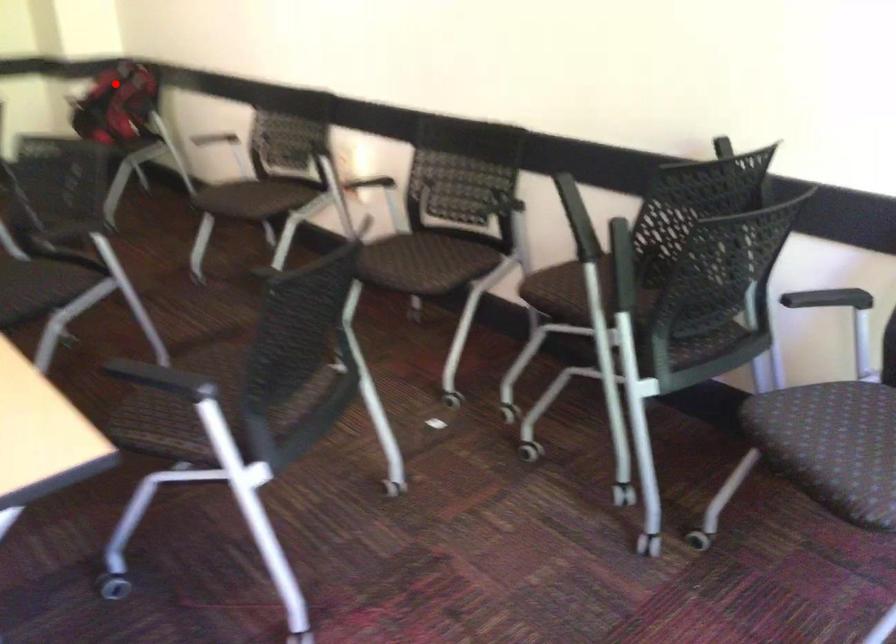
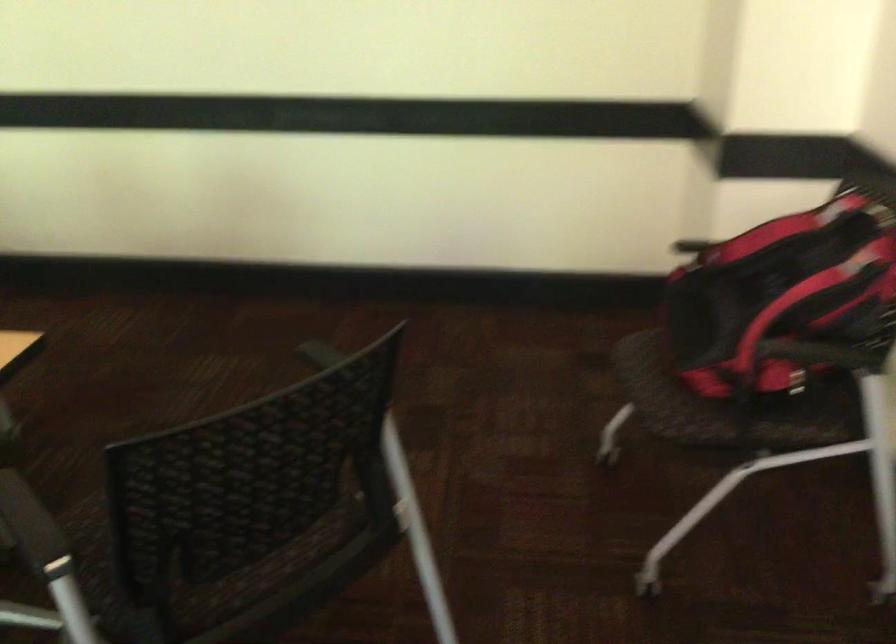
Find the pixel in the second image that matches the highlighted location in the first image.

(785, 283)